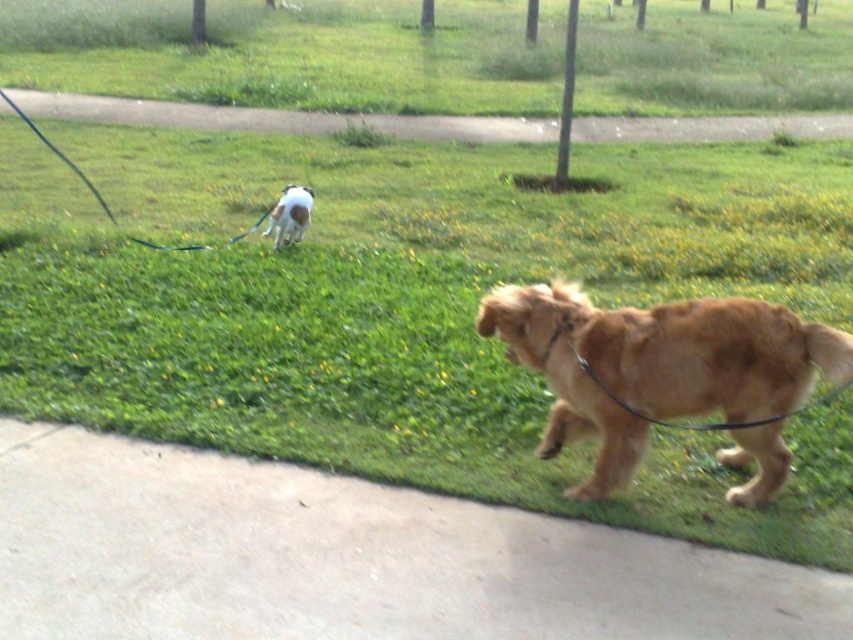
Question: Is gray concrete pavement at lower left bigger than black rubber leash at upper left?

Choices:
 (A) yes
 (B) no

Answer: (B)

Question: Considering the real-world distances, which object is farthest from the gray concrete pavement at lower left?

Choices:
 (A) white fur dog at center
 (B) golden fur dog at center

Answer: (A)

Question: Is gray concrete pavement at lower left to the left of white fur dog at center from the viewer's perspective?

Choices:
 (A) yes
 (B) no

Answer: (B)

Question: Which object is closer to the camera taking this photo?

Choices:
 (A) white fur dog at center
 (B) golden fur dog at center
 (C) gray concrete pavement at lower left

Answer: (C)

Question: Which object is the closest to the white fur dog at center?

Choices:
 (A) golden fur dog at center
 (B) gray concrete pavement at lower left
 (C) black rubber leash at upper left

Answer: (C)

Question: Can you confirm if gray concrete pavement at lower left is wider than golden fur dog at center?

Choices:
 (A) no
 (B) yes

Answer: (B)